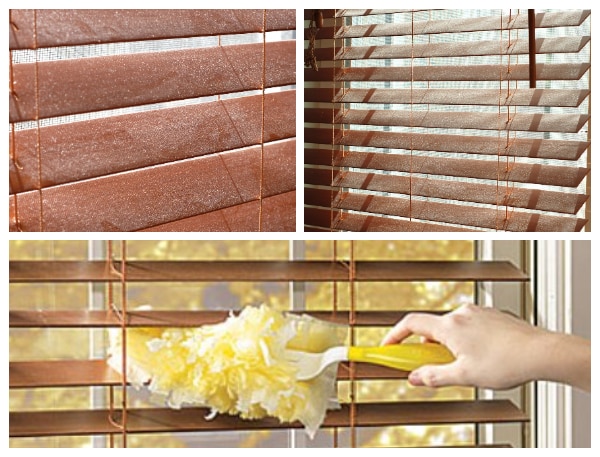
Locate an element on the screen. handle is located at coordinates (401, 359).